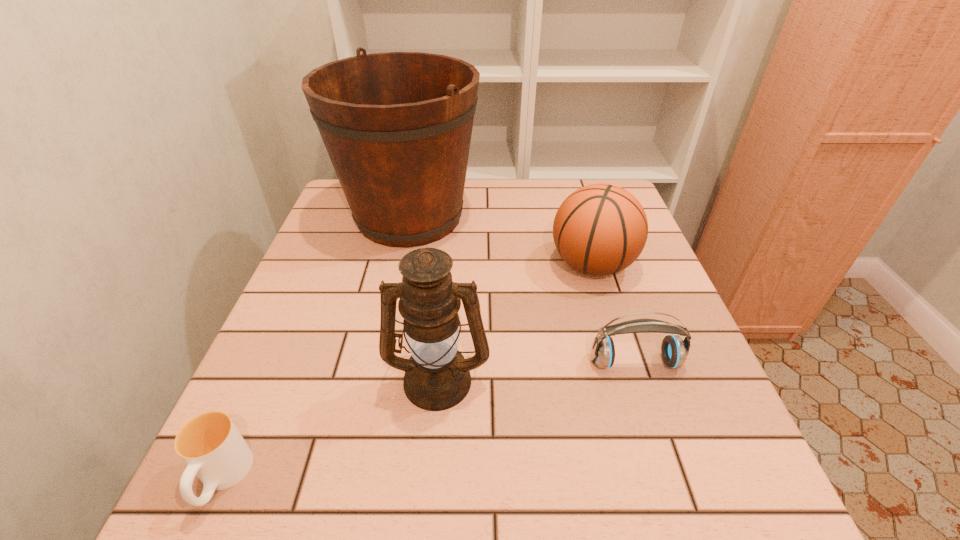
At what (x,y) coordinates should I click in order to perform the action: click on bucket. Please return your answer as a coordinate pair (x, y). The height and width of the screenshot is (540, 960). Looking at the image, I should click on (397, 126).

Identify the location of the fourth shortest object. (437, 377).

Where is `the third tallest object`? The height and width of the screenshot is (540, 960). the third tallest object is located at coordinates (600, 229).

Find the location of `headset`. headset is located at coordinates (674, 350).

The width and height of the screenshot is (960, 540). Identify the location of the nearest object. (210, 444).

Locate an element on the screen. This screenshot has height=540, width=960. cup is located at coordinates point(210,444).

Where is `vacant space located 0.300m on the front of the tallest object`? This screenshot has height=540, width=960. vacant space located 0.300m on the front of the tallest object is located at coordinates (378, 360).

Image resolution: width=960 pixels, height=540 pixels. In order to click on vacant space located 0.110m on the left of the fourth shortest object in this screenshot , I will do `click(326, 378)`.

Identify the location of free space located on the left of the third tallest object. (524, 264).

The width and height of the screenshot is (960, 540). I want to click on vacant area situated 0.140m on the ear cups of the headset, so click(662, 447).